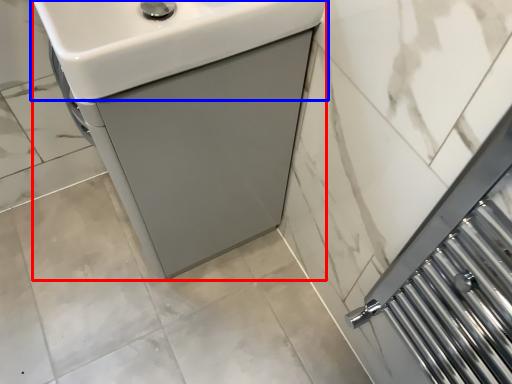
Question: Which point is closer to the camera, sink (highlighted by a red box) or sink (highlighted by a blue box)?

Choices:
 (A) sink
 (B) sink

Answer: (B)